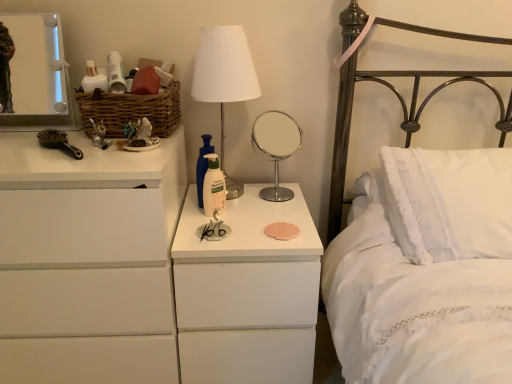
Where is `free location in front of black plastic brush at left`? The width and height of the screenshot is (512, 384). free location in front of black plastic brush at left is located at coordinates (42, 165).